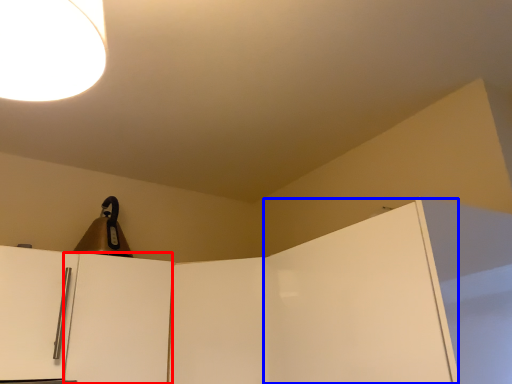
Question: Which point is closer to the camera, door (highlighted by a red box) or door (highlighted by a blue box)?

Choices:
 (A) door
 (B) door

Answer: (B)